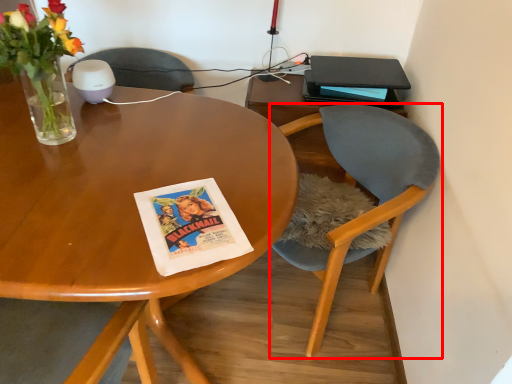
Question: From the image's perspective, what is the correct spatial positioning of chair (annotated by the red box) in reference to paperback book?

Choices:
 (A) below
 (B) above

Answer: (A)